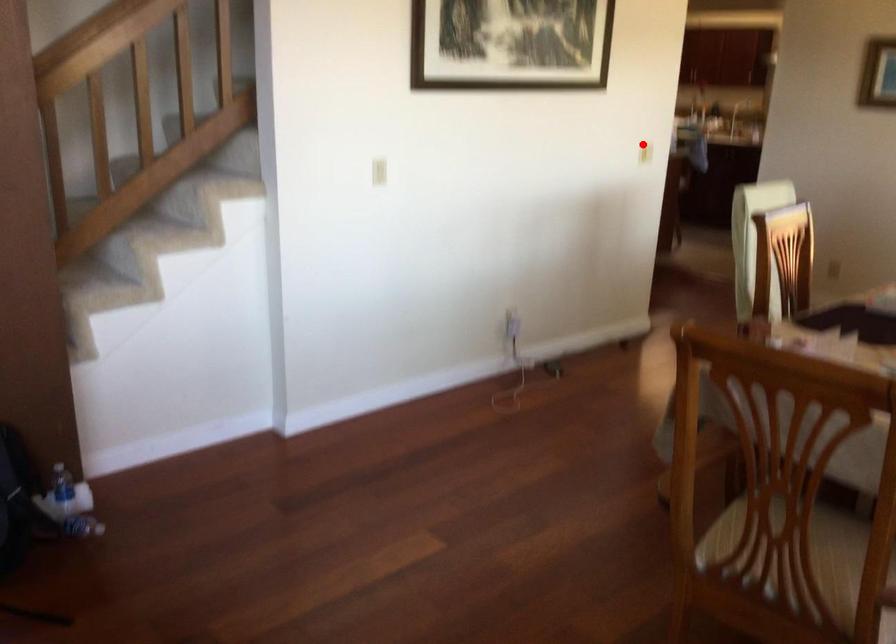
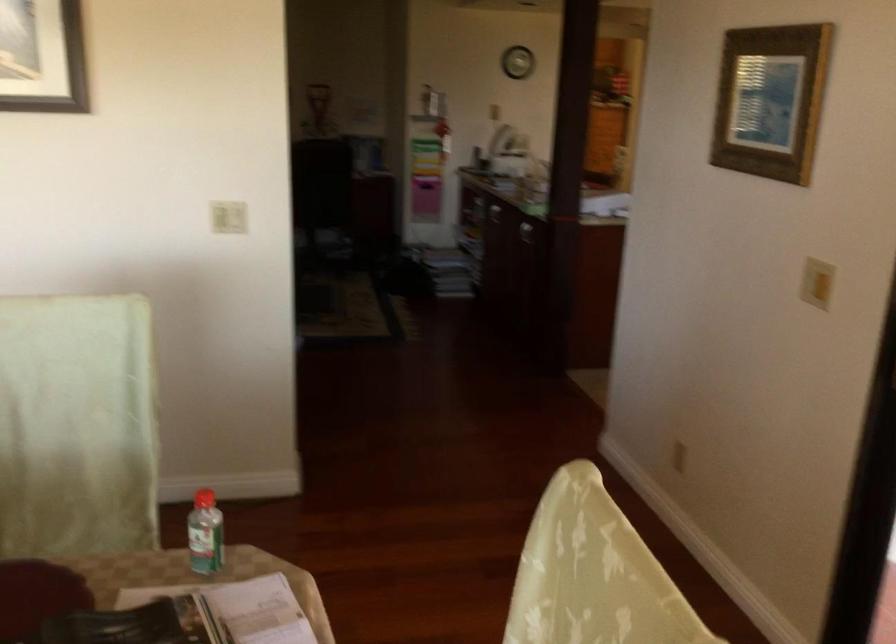
Question: I am providing you with two images of the same scene from different viewpoints. Image1 has a red point marked. In image2, the corresponding 3D location appears at what relative position? Reply with the corresponding letter.

Choices:
 (A) Closer
 (B) Farther

Answer: (A)